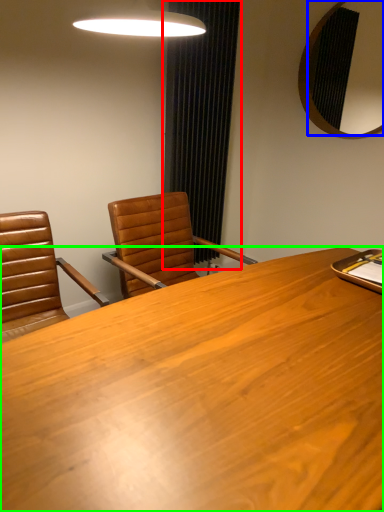
Question: Estimate the real-world distances between objects in this image. Which object is closer to curtain (highlighted by a red box), mirror (highlighted by a blue box) or desk (highlighted by a green box)?

Choices:
 (A) mirror
 (B) desk

Answer: (A)